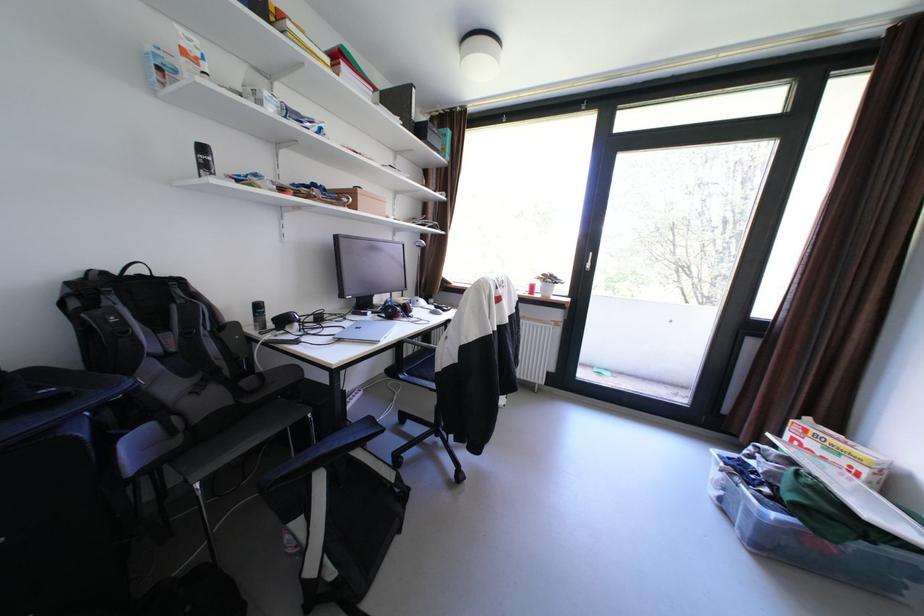
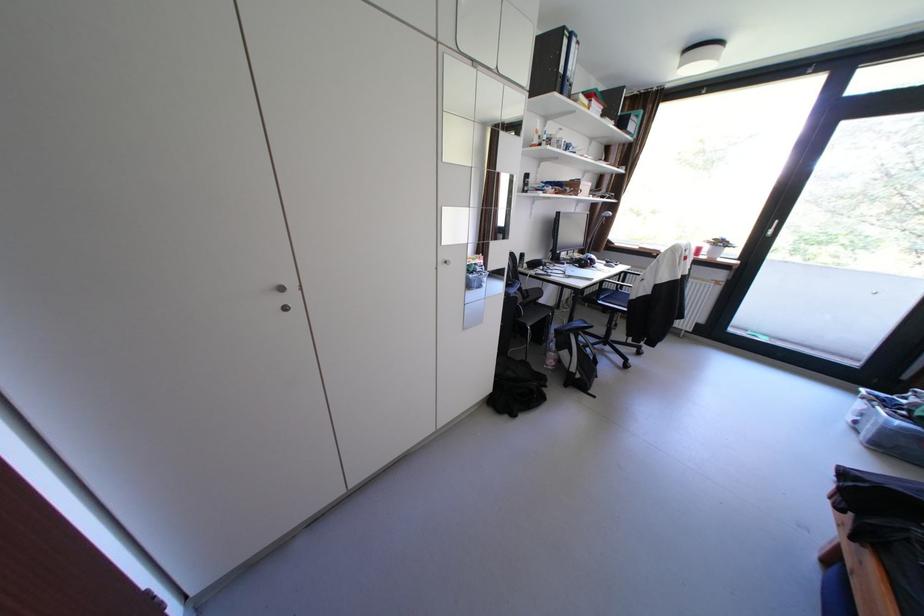
The point at [311,519] is marked in the first image. Where is the corresponding point in the second image?

(578, 351)